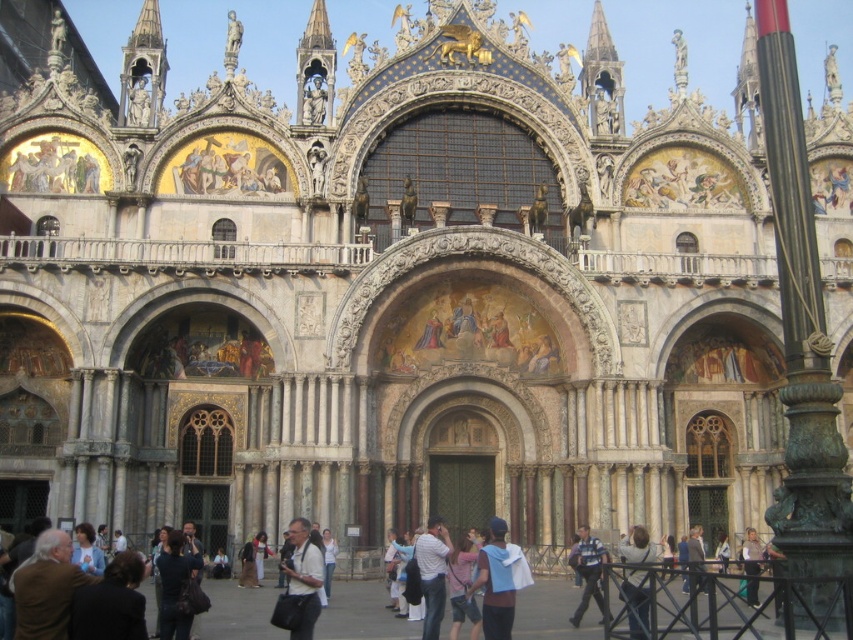
Question: Does light gray fabric shirt at center appear on the left side of blue denim jeans at lower center?

Choices:
 (A) no
 (B) yes

Answer: (B)

Question: Does light blue denim jacket at lower right come in front of light brown leather jacket at lower right?

Choices:
 (A) yes
 (B) no

Answer: (B)

Question: Which object appears closest to the camera in this image?

Choices:
 (A) light blue denim jacket at lower right
 (B) light brown leather jacket at lower right
 (C) dark blue fabric at center

Answer: (B)

Question: Is dark blue fabric at center closer to camera compared to blue denim jeans at lower center?

Choices:
 (A) no
 (B) yes

Answer: (B)

Question: Which point is farther to the camera?

Choices:
 (A) blue denim jeans at lower center
 (B) light gray fabric shirt at center

Answer: (A)

Question: Which object is the farthest from the light brown leather jacket at lower right?

Choices:
 (A) light blue denim jacket at lower right
 (B) blue denim jeans at lower center

Answer: (B)